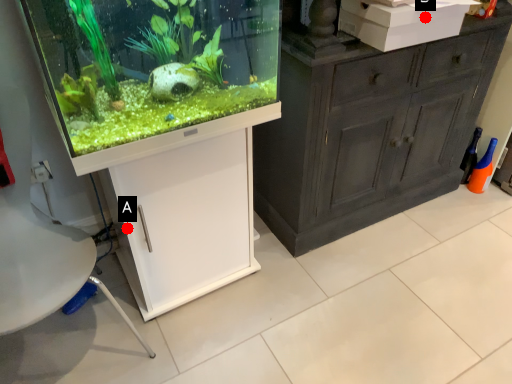
Question: Two points are circled on the image, labeled by A and B beside each circle. Which point is closer to the camera taking this photo?

Choices:
 (A) A is closer
 (B) B is closer

Answer: (A)